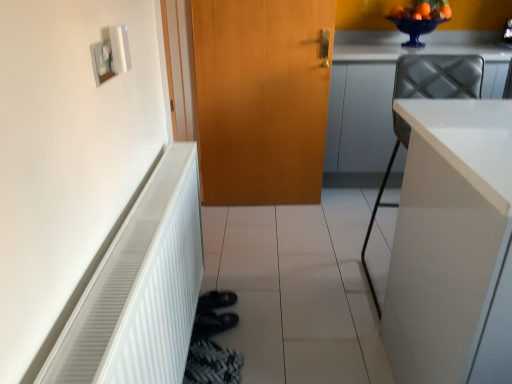
Question: Considering the positions of white glossy cabinet at upper right, marked as the 1th cabinetry in a back-to-front arrangement, and white ribbed radiator at left in the image, is white glossy cabinet at upper right, marked as the 1th cabinetry in a back-to-front arrangement, taller or shorter than white ribbed radiator at left?

Choices:
 (A) short
 (B) tall

Answer: (B)

Question: From a real-world perspective, is white glossy cabinet at upper right, marked as the 1th cabinetry in a back-to-front arrangement, positioned above or below white ribbed radiator at left?

Choices:
 (A) below
 (B) above

Answer: (B)

Question: Which object is positioned farthest from the white plastic light switch at upper left?

Choices:
 (A) wooden door at center
 (B) white ribbed radiator at left
 (C) white glossy cabinet at right, acting as the second cabinetry starting from the back
 (D) white glossy cabinet at upper right, placed as the second cabinetry when sorted from front to back

Answer: (D)

Question: Which of these objects is positioned closest to the white plastic light switch at upper left?

Choices:
 (A) white glossy cabinet at upper right, placed as the second cabinetry when sorted from front to back
 (B) white glossy cabinet at right, acting as the second cabinetry starting from the back
 (C) wooden door at center
 (D) white ribbed radiator at left

Answer: (D)